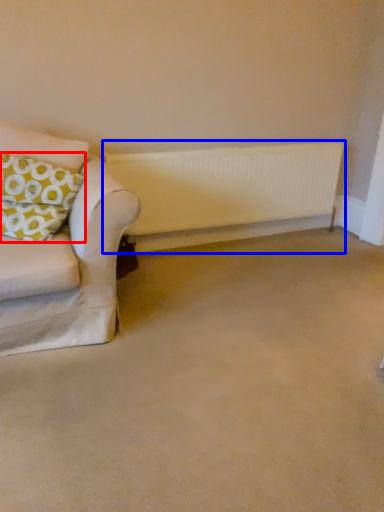
Question: Among these objects, which one is nearest to the camera, pillow (highlighted by a red box) or radiator (highlighted by a blue box)?

Choices:
 (A) pillow
 (B) radiator

Answer: (A)